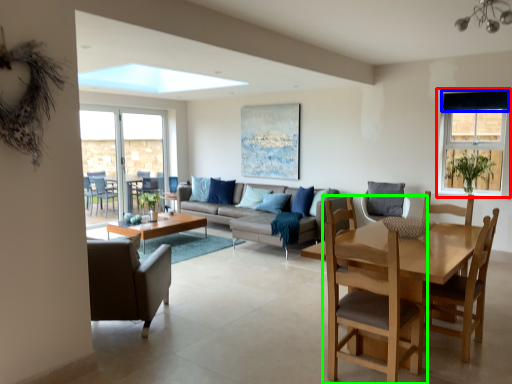
Question: Based on their relative distances, which object is nearer to window (highlighted by a red box)? Choose from curtain (highlighted by a blue box) and chair (highlighted by a green box).

Choices:
 (A) curtain
 (B) chair

Answer: (A)